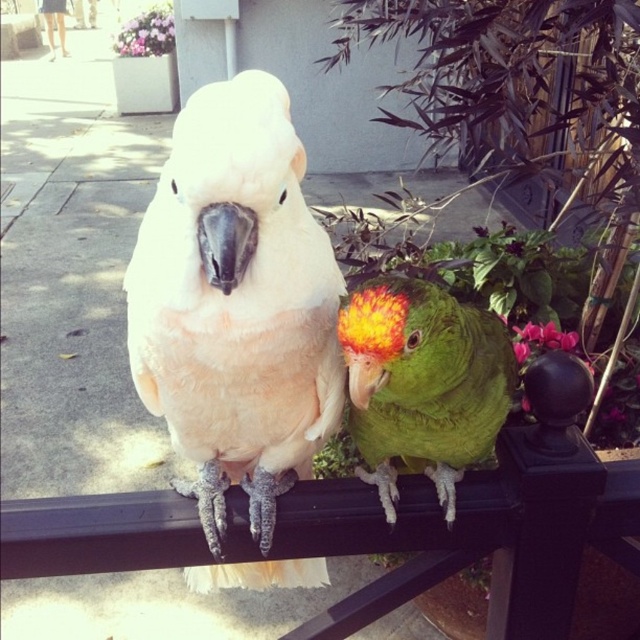
Question: Among these objects, which one is farthest from the camera?

Choices:
 (A) green matte parrot at center
 (B) white feathered parrot at center

Answer: (A)

Question: Can you confirm if white feathered parrot at center is positioned above green matte parrot at center?

Choices:
 (A) yes
 (B) no

Answer: (B)

Question: Is white feathered parrot at center closer to the viewer compared to green matte parrot at center?

Choices:
 (A) yes
 (B) no

Answer: (A)

Question: Does white feathered parrot at center lie in front of green matte parrot at center?

Choices:
 (A) no
 (B) yes

Answer: (B)

Question: Which object is farther from the camera taking this photo?

Choices:
 (A) green matte parrot at center
 (B) white feathered parrot at center

Answer: (A)